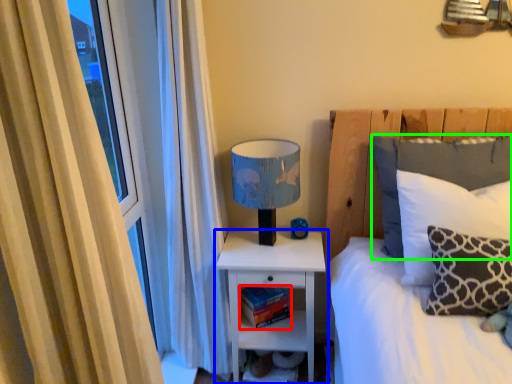
Question: Which is farther away from book (highlighted by a red box)? nightstand (highlighted by a blue box) or pillow (highlighted by a green box)?

Choices:
 (A) nightstand
 (B) pillow

Answer: (B)